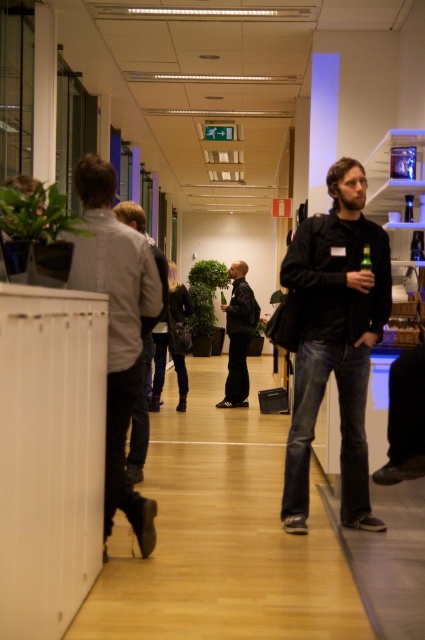
Can you confirm if light gray fabric jacket at left is positioned to the right of green glass bottle at center?

In fact, light gray fabric jacket at left is to the left of green glass bottle at center.

Does light gray fabric jacket at left have a greater height compared to green glass bottle at center?

Yes.

Measure the distance between light gray fabric jacket at left and camera.

The distance of light gray fabric jacket at left from camera is 8.19 feet.

Image resolution: width=425 pixels, height=640 pixels. In order to click on light gray fabric jacket at left in this screenshot , I will do `click(116, 328)`.

The width and height of the screenshot is (425, 640). I want to click on matte black jacket at center, so click(334, 339).

Does matte black jacket at center have a smaller size compared to light gray fabric jacket at left?

Yes.

This screenshot has width=425, height=640. In order to click on matte black jacket at center in this screenshot , I will do `click(334, 339)`.

What are the coordinates of `matte black jacket at center` in the screenshot? It's located at (334, 339).

Is matte black jacket at center above green glass bottle at center?

No.

Does point (354, 236) come behind point (368, 250)?

That is True.

Locate an element on the screen. matte black jacket at center is located at coordinates (334, 339).

You are a GUI agent. You are given a task and a screenshot of the screen. Output one action in this format:
    pyautogui.click(x=<x>, y=<y>)
    Task: Click on the matte black jacket at center
    The width and height of the screenshot is (425, 640).
    Given the screenshot: What is the action you would take?
    pyautogui.click(x=334, y=339)